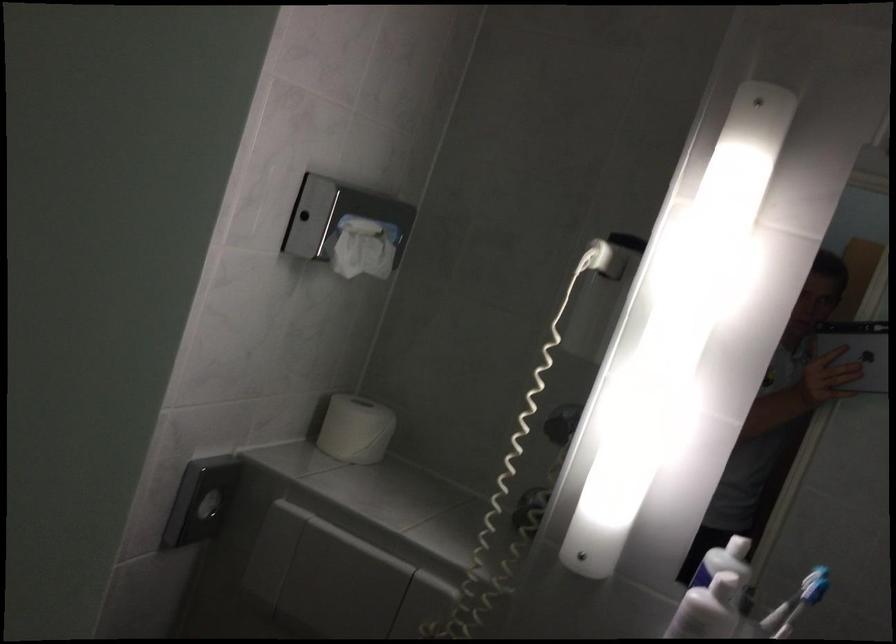
Where is `blue toothbrush`? The width and height of the screenshot is (896, 644). blue toothbrush is located at coordinates (805, 599).